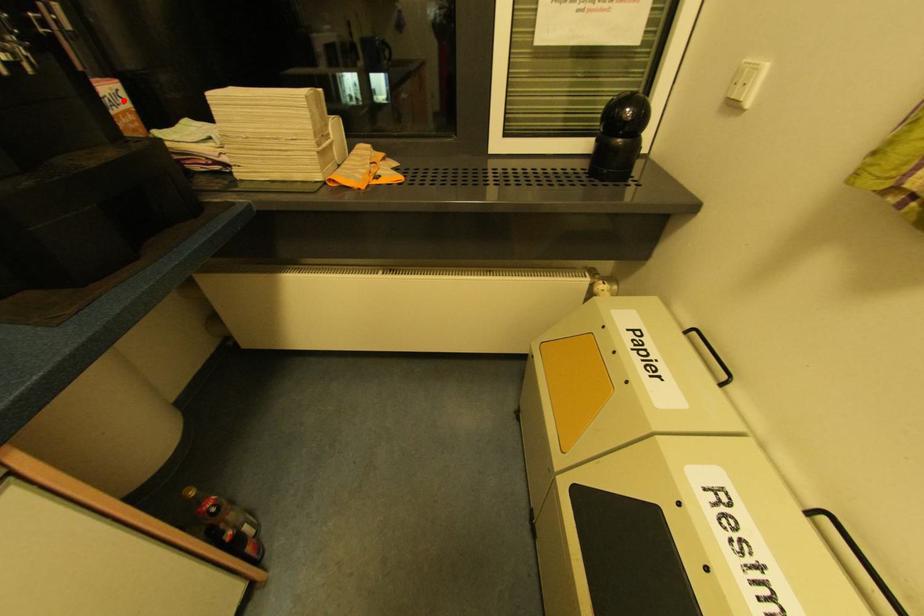
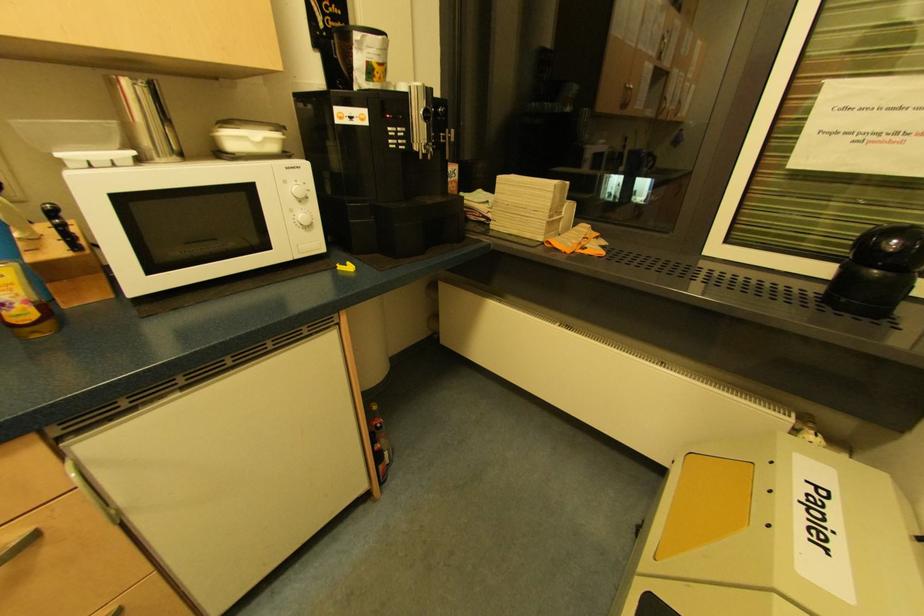
Question: I am providing you with two images of the same scene from different viewpoints. In image1, a red point is highlighted. Considering the same 3D point in image2, which of the following is correct?

Choices:
 (A) It is closer
 (B) It is farther

Answer: (A)